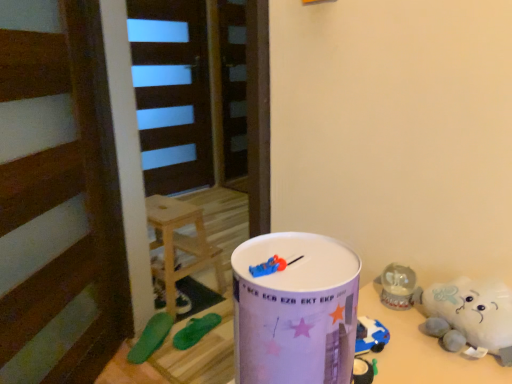
Question: From the image's perspective, would you say green rubber toy at lower left, which is the 1th toy in back-to-front order, is shown under white plush toy at lower right?

Choices:
 (A) yes
 (B) no

Answer: (A)

Question: Is green rubber toy at lower left, which is the 1th toy in back-to-front order, wider than white plush toy at lower right?

Choices:
 (A) yes
 (B) no

Answer: (B)

Question: Considering the relative sizes of green rubber toy at lower left, arranged as the third toy when viewed from the front, and white plush toy at lower right in the image provided, is green rubber toy at lower left, arranged as the third toy when viewed from the front, shorter than white plush toy at lower right?

Choices:
 (A) no
 (B) yes

Answer: (B)

Question: Are green rubber toy at lower left, which is the 1th toy in back-to-front order, and white plush toy at lower right making contact?

Choices:
 (A) no
 (B) yes

Answer: (A)

Question: Can you confirm if green rubber toy at lower left, which is the 1th toy in back-to-front order, is thinner than white plush toy at lower right?

Choices:
 (A) no
 (B) yes

Answer: (B)

Question: From the image's perspective, relative to green rubber toy at lower left, which ranks as the first toy in front-to-back order, is wooden stool at center above or below?

Choices:
 (A) below
 (B) above

Answer: (B)

Question: Considering the positions of wooden stool at center and green rubber toy at lower left, marked as the third toy in a back-to-front arrangement, in the image, is wooden stool at center wider or thinner than green rubber toy at lower left, marked as the third toy in a back-to-front arrangement,?

Choices:
 (A) wide
 (B) thin

Answer: (A)

Question: Is wooden stool at center inside the boundaries of green rubber toy at lower left, which ranks as the first toy in front-to-back order, or outside?

Choices:
 (A) inside
 (B) outside

Answer: (B)

Question: Considering the positions of point (182, 271) and point (168, 321), is point (182, 271) closer or farther from the camera than point (168, 321)?

Choices:
 (A) closer
 (B) farther

Answer: (B)

Question: In terms of height, does wooden stool at center look taller or shorter compared to green rubber toy at lower left, arranged as the third toy when viewed from the front?

Choices:
 (A) tall
 (B) short

Answer: (A)

Question: Considering the positions of wooden stool at center and green rubber toy at lower left, which is the 1th toy in back-to-front order, in the image, is wooden stool at center wider or thinner than green rubber toy at lower left, which is the 1th toy in back-to-front order,?

Choices:
 (A) thin
 (B) wide

Answer: (B)

Question: Is wooden stool at center inside the boundaries of green rubber toy at lower left, which is the 1th toy in back-to-front order, or outside?

Choices:
 (A) outside
 (B) inside

Answer: (A)

Question: From a real-world perspective, is wooden stool at center physically located above or below green rubber toy at lower left, which is the 1th toy in back-to-front order?

Choices:
 (A) above
 (B) below

Answer: (A)

Question: From a real-world perspective, relative to green rubber toy at lower left, marked as the third toy in a back-to-front arrangement, is green rubber toy at lower left, arranged as the third toy when viewed from the front, vertically above or below?

Choices:
 (A) below
 (B) above

Answer: (A)

Question: Is point (158, 284) positioned closer to the camera than point (138, 345)?

Choices:
 (A) closer
 (B) farther

Answer: (B)